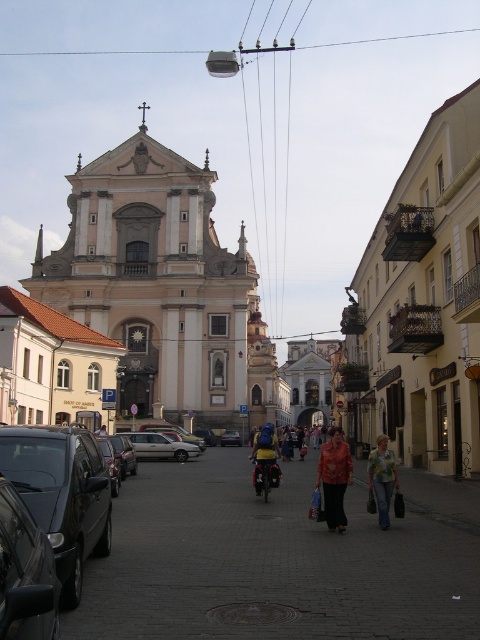
Measure the distance between point (143, 115) and camera.

Point (143, 115) is 468.03 feet from camera.

Does white stone church at upper center have a larger size compared to shiny black car at left?

Yes, white stone church at upper center is bigger than shiny black car at left.

Find the location of `white stone church at upper center`. white stone church at upper center is located at coordinates (164, 289).

The width and height of the screenshot is (480, 640). I want to click on white stone church at upper center, so click(x=164, y=289).

Who is taller, silver metallic sedan at center or metallic silver car at center?

Standing taller between the two is silver metallic sedan at center.

This screenshot has height=640, width=480. I want to click on silver metallic sedan at center, so click(x=159, y=445).

Is yellow-green shirt at center behind yellow fabric backpack at center?

No, yellow-green shirt at center is in front of yellow fabric backpack at center.

Which is in front, point (377, 456) or point (279, 474)?

Point (377, 456)

Where is `yellow-green shirt at center`? The height and width of the screenshot is (640, 480). yellow-green shirt at center is located at coordinates (382, 477).

This screenshot has width=480, height=640. Identify the location of yellow-green shirt at center. (382, 477).